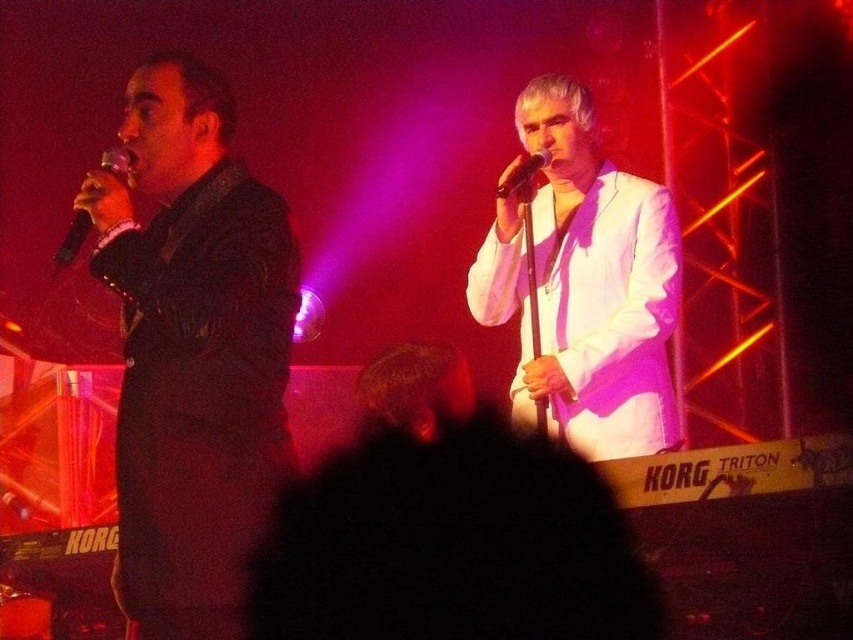
You are a stagehand who needs to adjust the lighting for the performers. The matte black suit at left and the black matte microphone at upper center are both in your view. Which object is wider?

The matte black suit at left is wider than the black matte microphone at upper center.

You are a photographer in the audience at this concert. You want to take a photo of both the matte black suit at left and the white satin suit at center so that both are fully visible. Based on their positions, which performer should you focus on first to ensure both are in frame?

The matte black suit at left is in front of the white satin suit at center, so you should focus on the white satin suit at center first to ensure both are fully visible in the photo.